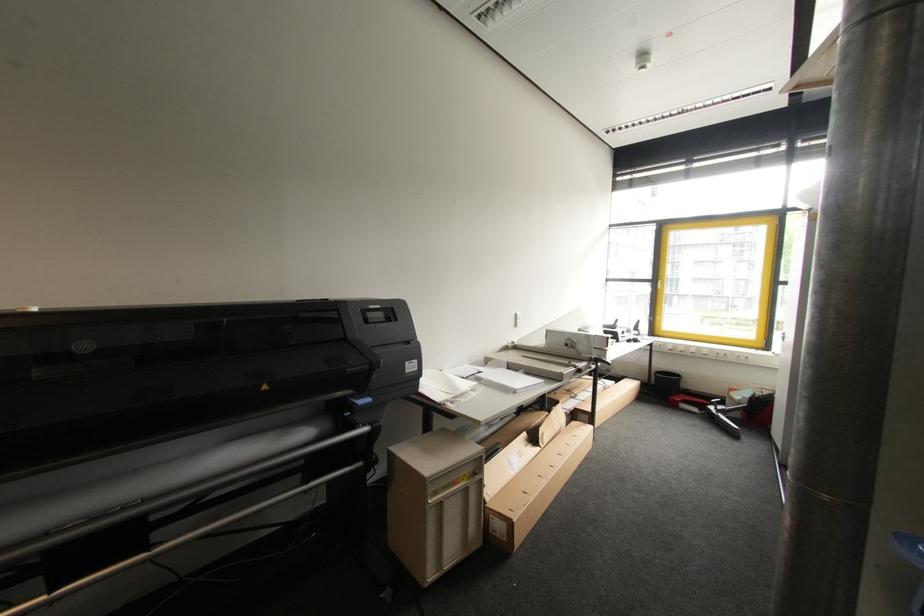
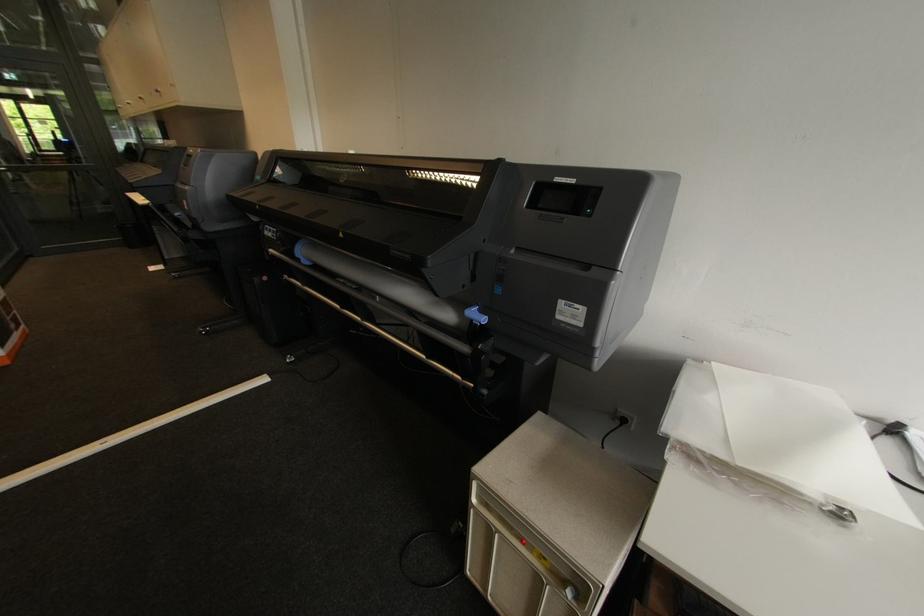
Locate, in the second image, the point that corresponds to (x=410, y=371) in the first image.

(563, 318)